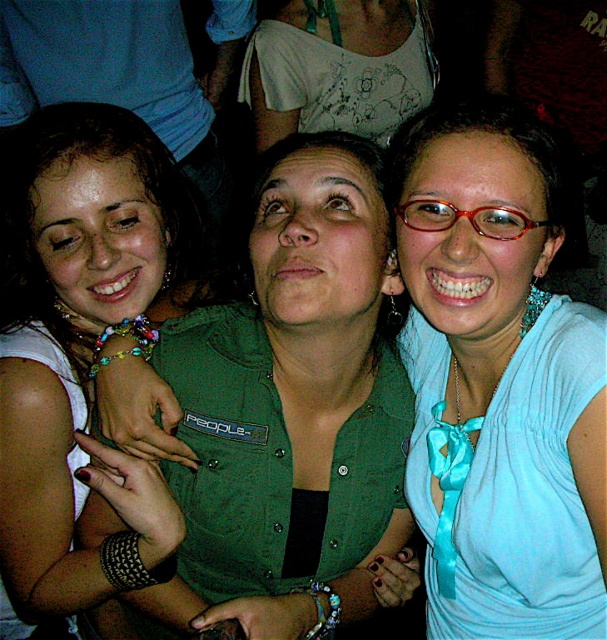
You are taking a photo of three women standing in a line. The women are wearing a matte green shirt at center, a white sleeveless top on the left, and a light blue top on the right. Based on their positions, which woman is standing in the middle?

The woman wearing the matte green shirt at center is standing in the middle.

You are a photographer standing at a certain distance from the matte green shirt at center. If you want to ensure the subject remains in focus while taking a photo, and your camera has a minimum focusing distance of 36 inches, will you need to move closer or farther away?

The distance between the matte green shirt at center and the camera is 34.31 inches, which is less than the camera minimum focusing distance of 36 inches. Therefore, you need to move farther away to ensure the subject stays in focus.